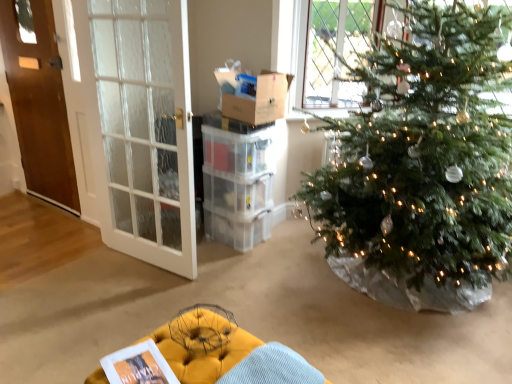
Measure the distance between white glass door at left, which is the 2th door in back-to-front order, and camera.

The depth of white glass door at left, which is the 2th door in back-to-front order, is 8.22 feet.

What do you see at coordinates (39, 101) in the screenshot?
I see `brown wooden door at left, positioned as the first door in back-to-front order` at bounding box center [39, 101].

Find the location of a particular element. clear plastic crate at center is located at coordinates (238, 150).

The width and height of the screenshot is (512, 384). What do you see at coordinates (238, 150) in the screenshot? I see `clear plastic crate at center` at bounding box center [238, 150].

Find the location of a particular element. white glass door at left, which is the 2th door in back-to-front order is located at coordinates (141, 126).

Consider the image. Is clear plastic crate at center positioned in front of white glass door at left, the first door when ordered from front to back?

That is False.

From a real-world perspective, who is located higher, clear plastic crate at center or white glass door at left, which is the 2th door in back-to-front order?

In real-world perspective, white glass door at left, which is the 2th door in back-to-front order, is above.

Is white glass door at left, the first door when ordered from front to back, completely or partially inside clear plastic crate at center?

No.

Is point (249, 139) positioned after point (123, 94)?

That is False.

Is brown wooden door at left, which appears as the 2th door when viewed from the right, oriented towards yellow tufted ottoman at lower center?

No, brown wooden door at left, which appears as the 2th door when viewed from the right, is not facing towards yellow tufted ottoman at lower center.

Considering the relative sizes of brown wooden door at left, which is the 2th door from front to back, and yellow tufted ottoman at lower center in the image provided, is brown wooden door at left, which is the 2th door from front to back, bigger than yellow tufted ottoman at lower center?

Incorrect, brown wooden door at left, which is the 2th door from front to back, is not larger than yellow tufted ottoman at lower center.

Are brown wooden door at left, positioned as the first door in back-to-front order, and yellow tufted ottoman at lower center making contact?

brown wooden door at left, positioned as the first door in back-to-front order, and yellow tufted ottoman at lower center are not in contact.

Locate an element on the screen. The height and width of the screenshot is (384, 512). crate above the yellow tufted ottoman at lower center (from a real-world perspective) is located at coordinates (238, 150).

Is yellow tufted ottoman at lower center positioned beyond the bounds of clear plastic crate at center?

Absolutely, yellow tufted ottoman at lower center is external to clear plastic crate at center.

Which is more to the left, yellow tufted ottoman at lower center or clear plastic crate at center?

Positioned to the left is yellow tufted ottoman at lower center.

Could you tell me if cardboard box at upper center is turned towards clear plastic crate at center?

No.

Is cardboard box at upper center in front of clear plastic crate at center?

Yes, it is in front of clear plastic crate at center.

From a real-world perspective, is cardboard box at upper center on top of clear plastic crate at center?

Correct, in the physical world, cardboard box at upper center is higher than clear plastic crate at center.

Find the location of a particular element. crate behind the cardboard box at upper center is located at coordinates (238, 150).

Looking at this image, considering the positions of objects cardboard box at upper center and yellow tufted ottoman at lower center in the image provided, who is in front, cardboard box at upper center or yellow tufted ottoman at lower center?

Positioned in front is yellow tufted ottoman at lower center.

Does cardboard box at upper center have a lesser height compared to yellow tufted ottoman at lower center?

Correct, cardboard box at upper center is not as tall as yellow tufted ottoman at lower center.

Based on the photo, between cardboard box at upper center and yellow tufted ottoman at lower center, which one appears on the left side from the viewer's perspective?

yellow tufted ottoman at lower center.

From a real-world perspective, is cardboard box at upper center located beneath yellow tufted ottoman at lower center?

No, from a real-world perspective, cardboard box at upper center is not beneath yellow tufted ottoman at lower center.

Is yellow tufted ottoman at lower center inside or outside of cardboard box at upper center?

yellow tufted ottoman at lower center is outside cardboard box at upper center.

Is yellow tufted ottoman at lower center bigger or smaller than cardboard box at upper center?

In the image, yellow tufted ottoman at lower center appears to be larger than cardboard box at upper center.

How many degrees apart are the facing directions of yellow tufted ottoman at lower center and cardboard box at upper center?

The angular difference between yellow tufted ottoman at lower center and cardboard box at upper center is 178 degrees.

Find the location of a particular element. furniture on the left of the cardboard box at upper center is located at coordinates (205, 356).

Which of these two, yellow tufted ottoman at lower center or brown wooden door at left, positioned as the first door in back-to-front order, is smaller?

With smaller size is brown wooden door at left, positioned as the first door in back-to-front order.

Between yellow tufted ottoman at lower center and brown wooden door at left, the 1th door in the left-to-right sequence, which one is positioned behind?

brown wooden door at left, the 1th door in the left-to-right sequence, is further from the camera.

Is yellow tufted ottoman at lower center not near brown wooden door at left, which appears as the 2th door when viewed from the right?

Yes.

Where is `furniture below the brown wooden door at left, which is the 2th door from front to back (from a real-world perspective)`? This screenshot has height=384, width=512. furniture below the brown wooden door at left, which is the 2th door from front to back (from a real-world perspective) is located at coordinates (205, 356).

Where is `the 1st door directly above the clear plastic crate at center (from a real-world perspective)`? the 1st door directly above the clear plastic crate at center (from a real-world perspective) is located at coordinates (141, 126).

Locate an element on the screen. The width and height of the screenshot is (512, 384). door that is the 2nd one when counting upward from the yellow tufted ottoman at lower center (from the image's perspective) is located at coordinates (39, 101).

Looking at the image, which one is located further to brown wooden door at left, the 1th door in the left-to-right sequence, cardboard box at upper center or white glass door at left, positioned as the first door in right-to-left order?

cardboard box at upper center is positioned further to the anchor brown wooden door at left, the 1th door in the left-to-right sequence.

From the image, which object appears to be farther from clear plastic crate at center, cardboard box at upper center or brown wooden door at left, which appears as the 2th door when viewed from the right?

brown wooden door at left, which appears as the 2th door when viewed from the right.

Which object lies nearer to the anchor point clear plastic crate at center, cardboard box at upper center or yellow tufted ottoman at lower center?

cardboard box at upper center is positioned closer to the anchor clear plastic crate at center.

When comparing their distances from yellow tufted ottoman at lower center, does clear plastic crate at center or white glass door at left, positioned as the first door in right-to-left order, seem closer?

Among the two, white glass door at left, positioned as the first door in right-to-left order, is located nearer to yellow tufted ottoman at lower center.

From the image, which object appears to be nearer to cardboard box at upper center, white glass door at left, the first door when ordered from front to back, or brown wooden door at left, the 1th door in the left-to-right sequence?

white glass door at left, the first door when ordered from front to back.

Based on their spatial positions, is clear plastic crate at center or cardboard box at upper center closer to white glass door at left, the first door when ordered from front to back?

Among the two, clear plastic crate at center is located nearer to white glass door at left, the first door when ordered from front to back.

Based on the photo, looking at the image, which one is located closer to yellow tufted ottoman at lower center, white glass door at left, which is the 2th door in back-to-front order, or brown wooden door at left, which is the 2th door from front to back?

white glass door at left, which is the 2th door in back-to-front order, is positioned closer to the anchor yellow tufted ottoman at lower center.

Considering their positions, is yellow tufted ottoman at lower center positioned further to clear plastic crate at center than white glass door at left, the first door when ordered from front to back?

yellow tufted ottoman at lower center lies further to clear plastic crate at center than the other object.

You are a GUI agent. You are given a task and a screenshot of the screen. Output one action in this format:
    pyautogui.click(x=<x>, y=<y>)
    Task: Click on the door positioned between yellow tufted ottoman at lower center and clear plastic crate at center from near to far
    
    Given the screenshot: What is the action you would take?
    pyautogui.click(x=141, y=126)

This screenshot has height=384, width=512. In order to click on door between yellow tufted ottoman at lower center and brown wooden door at left, which is the 2th door from front to back, from front to back in this screenshot , I will do `click(141, 126)`.

You are a GUI agent. You are given a task and a screenshot of the screen. Output one action in this format:
    pyautogui.click(x=<x>, y=<y>)
    Task: Click on the door between brown wooden door at left, which is the 2th door from front to back, and cardboard box at upper center from left to right
    This screenshot has height=384, width=512.
    Given the screenshot: What is the action you would take?
    pyautogui.click(x=141, y=126)

I want to click on crate situated between brown wooden door at left, positioned as the first door in back-to-front order, and cardboard box at upper center from left to right, so click(x=238, y=150).